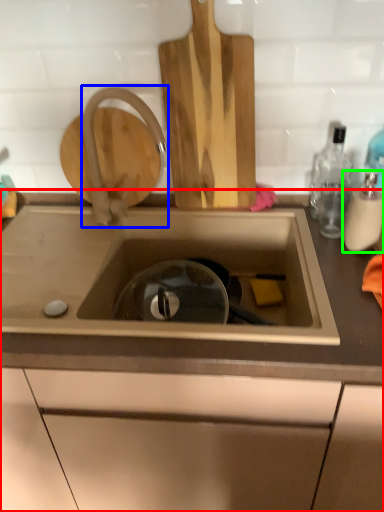
Question: Which is nearer to the countertop (highlighted by a red box)? tap (highlighted by a blue box) or bottle (highlighted by a green box).

Choices:
 (A) tap
 (B) bottle

Answer: (A)